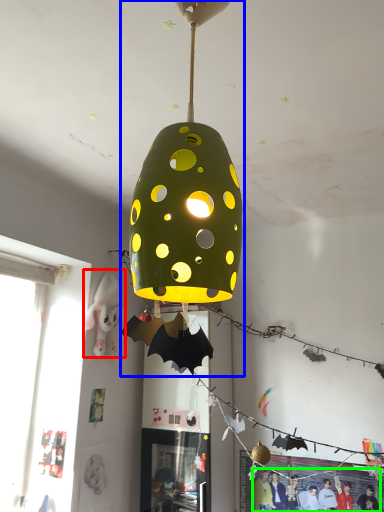
Question: Considering the real-world distances, which object is farthest from person (highlighted by a red box)? lamp (highlighted by a blue box) or person (highlighted by a green box)?

Choices:
 (A) lamp
 (B) person

Answer: (A)